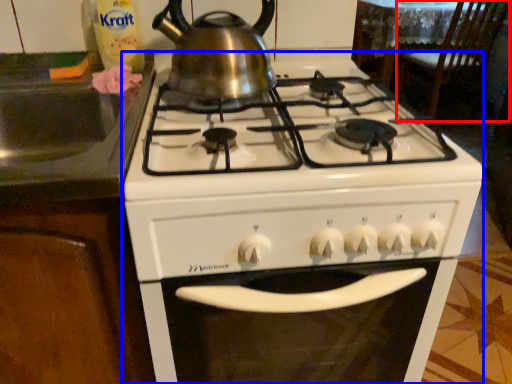
Question: Which object is further to the camera taking this photo, chair (highlighted by a red box) or gas stove (highlighted by a blue box)?

Choices:
 (A) chair
 (B) gas stove

Answer: (A)